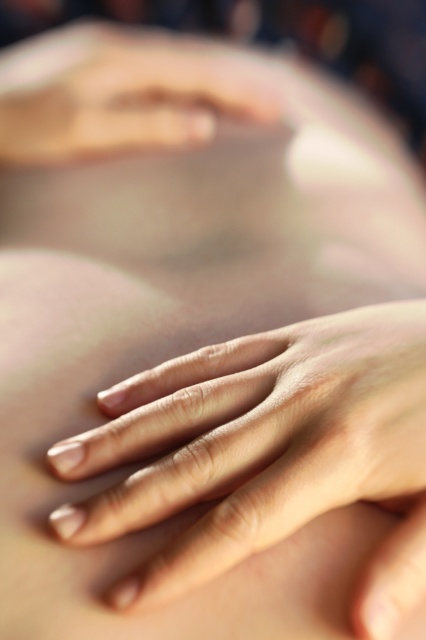
You are a therapist giving a massage to a client. You have two hands, the smooth skin hand at center and the smooth skin hand at upper center. Which hand is placed lower on the client?

The smooth skin hand at center is positioned under the smooth skin hand at upper center, so the smooth skin hand at center is placed lower on the client.

You are a therapist observing the smooth skin hand at center and the smooth skin hand at upper center on a client. Which hand is closer to you?

The smooth skin hand at center is closer to you because it is not as tall as the smooth skin hand at upper center, indicating it is positioned in front.

You are a robotic arm trying to touch the smooth skin hand at center. Your current position is at point 0.5,0.5. Can you reach it without moving past the point 0.7,0.6?

The smooth skin hand at center is at point (265,452). Since your current position is at (213,320) and you need to reach (265,452), the path would require moving past the point (255,448). Therefore, you cannot reach it without moving past that point.